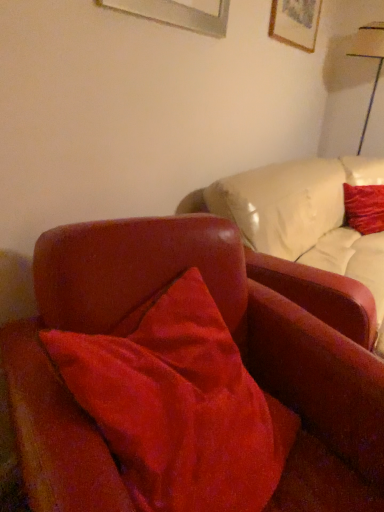
What do you see at coordinates (369, 57) in the screenshot? This screenshot has width=384, height=512. I see `white glossy table lamp at upper right` at bounding box center [369, 57].

This screenshot has height=512, width=384. In order to click on velvet red chair at center in this screenshot , I will do `click(234, 339)`.

What do you see at coordinates (364, 208) in the screenshot?
I see `velvet red pillow at upper right` at bounding box center [364, 208].

Measure the distance between point (291, 38) and camera.

Point (291, 38) and camera are 8.15 feet apart from each other.

Where is `wooden picture frame at upper right`? This screenshot has height=512, width=384. wooden picture frame at upper right is located at coordinates (295, 22).

The width and height of the screenshot is (384, 512). I want to click on white glossy table lamp at upper right, so click(x=369, y=57).

Is velvet red chair at center bigger or smaller than white glossy table lamp at upper right?

In the image, velvet red chair at center appears to be larger than white glossy table lamp at upper right.

From the picture: How much distance is there between velvet red chair at center and white glossy table lamp at upper right?

The distance of velvet red chair at center from white glossy table lamp at upper right is 9.51 feet.

Is velvet red chair at center far from white glossy table lamp at upper right?

Yes, velvet red chair at center and white glossy table lamp at upper right are quite far apart.

Is velvet red chair at center not within white glossy table lamp at upper right?

velvet red chair at center lies outside white glossy table lamp at upper right's area.

Does velvet red pillow at upper right have a lesser width compared to wooden picture frame at upper right?

In fact, velvet red pillow at upper right might be wider than wooden picture frame at upper right.

Where is `picture frame on the left of the velvet red pillow at upper right`? picture frame on the left of the velvet red pillow at upper right is located at coordinates (295, 22).

Is velvet red pillow at upper right in front of or behind wooden picture frame at upper right in the image?

velvet red pillow at upper right is positioned farther from the viewer than wooden picture frame at upper right.

Looking at this image, is wooden picture frame at upper right positioned in front of velvet red pillow at upper right?

Yes, it is.

Considering the positions of objects wooden picture frame at upper right and velvet red pillow at upper right in the image provided, who is more to the left, wooden picture frame at upper right or velvet red pillow at upper right?

From the viewer's perspective, wooden picture frame at upper right appears more on the left side.

From the image's perspective, between wooden picture frame at upper right and velvet red pillow at upper right, who is located below?

velvet red pillow at upper right, from the image's perspective.

Does wooden picture frame at upper right turn towards velvet red pillow at upper right?

No, wooden picture frame at upper right is not turned towards velvet red pillow at upper right.

Would you say velvet red pillow at upper right is outside velvet red chair at center?

Indeed, velvet red pillow at upper right is completely outside velvet red chair at center.

Considering the sizes of velvet red pillow at upper right and velvet red chair at center in the image, is velvet red pillow at upper right taller or shorter than velvet red chair at center?

In the image, velvet red pillow at upper right appears to be shorter than velvet red chair at center.

I want to click on pillow located behind the velvet red chair at center, so click(364, 208).

Considering the points (363, 195) and (298, 458), which point is in front, point (363, 195) or point (298, 458)?

Positioned in front is point (298, 458).

At what (x,y) coordinates should I click in order to perform the action: click on table lamp behind the velvet red pillow at upper right. Please return your answer as a coordinate pair (x, y). The height and width of the screenshot is (512, 384). Looking at the image, I should click on (369, 57).

From a real-world perspective, is white glossy table lamp at upper right located beneath velvet red pillow at upper right?

Actually, white glossy table lamp at upper right is physically above velvet red pillow at upper right in the real world.

Is point (368, 38) less distant than point (372, 203)?

That is False.

Between white glossy table lamp at upper right and wooden picture frame at upper right, which one has smaller width?

Thinner between the two is wooden picture frame at upper right.

In the scene shown: Is white glossy table lamp at upper right far from wooden picture frame at upper right?

white glossy table lamp at upper right is actually quite close to wooden picture frame at upper right.

From the picture: Is velvet red chair at center positioned beyond the bounds of wooden picture frame at upper right?

→ Indeed, velvet red chair at center is completely outside wooden picture frame at upper right.

Which object is positioned more to the left, velvet red chair at center or wooden picture frame at upper right?

velvet red chair at center.

Which is in front, velvet red chair at center or wooden picture frame at upper right?

velvet red chair at center is closer to the camera.

Locate an element on the screen. The image size is (384, 512). table lamp above the velvet red chair at center (from a real-world perspective) is located at coordinates (369, 57).

Locate an element on the screen. The height and width of the screenshot is (512, 384). pillow below the wooden picture frame at upper right (from the image's perspective) is located at coordinates (364, 208).

When comparing their distances from wooden picture frame at upper right, does velvet red pillow at upper right or white glossy table lamp at upper right seem closer?

Among the two, white glossy table lamp at upper right is located nearer to wooden picture frame at upper right.

Based on their spatial positions, is white glossy table lamp at upper right or wooden picture frame at upper right further from velvet red chair at center?

Among the two, white glossy table lamp at upper right is located further to velvet red chair at center.

Based on their spatial positions, is white glossy table lamp at upper right or velvet red chair at center further from velvet red pillow at upper right?

velvet red chair at center is further to velvet red pillow at upper right.

From the image, which object appears to be farther from white glossy table lamp at upper right, velvet red chair at center or velvet red pillow at upper right?

velvet red chair at center is further to white glossy table lamp at upper right.

Based on their spatial positions, is wooden picture frame at upper right or white glossy table lamp at upper right closer to velvet red pillow at upper right?

wooden picture frame at upper right is closer to velvet red pillow at upper right.

Considering their positions, is white glossy table lamp at upper right positioned further to wooden picture frame at upper right than velvet red chair at center?

velvet red chair at center is further to wooden picture frame at upper right.

Which object lies nearer to the anchor point wooden picture frame at upper right, white glossy table lamp at upper right or velvet red pillow at upper right?

white glossy table lamp at upper right.

When comparing their distances from white glossy table lamp at upper right, does velvet red pillow at upper right or wooden picture frame at upper right seem closer?

wooden picture frame at upper right lies closer to white glossy table lamp at upper right than the other object.

Where is `picture frame positioned between velvet red chair at center and velvet red pillow at upper right from near to far`? This screenshot has height=512, width=384. picture frame positioned between velvet red chair at center and velvet red pillow at upper right from near to far is located at coordinates (295, 22).

Identify the location of picture frame positioned between velvet red chair at center and white glossy table lamp at upper right from near to far. This screenshot has width=384, height=512. (295, 22).

Find the location of a particular element. The image size is (384, 512). pillow between velvet red chair at center and white glossy table lamp at upper right in the front-back direction is located at coordinates (364, 208).

The width and height of the screenshot is (384, 512). What are the coordinates of `table lamp that lies between wooden picture frame at upper right and velvet red pillow at upper right from top to bottom` in the screenshot? It's located at (369, 57).